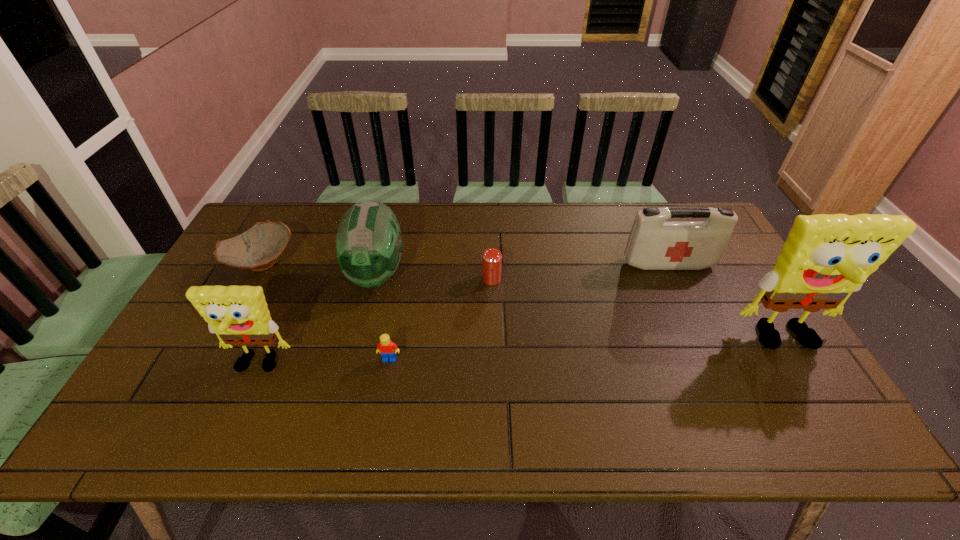
The image size is (960, 540). Identify the location of location for an additional sponge to make spacing equal. (528, 353).